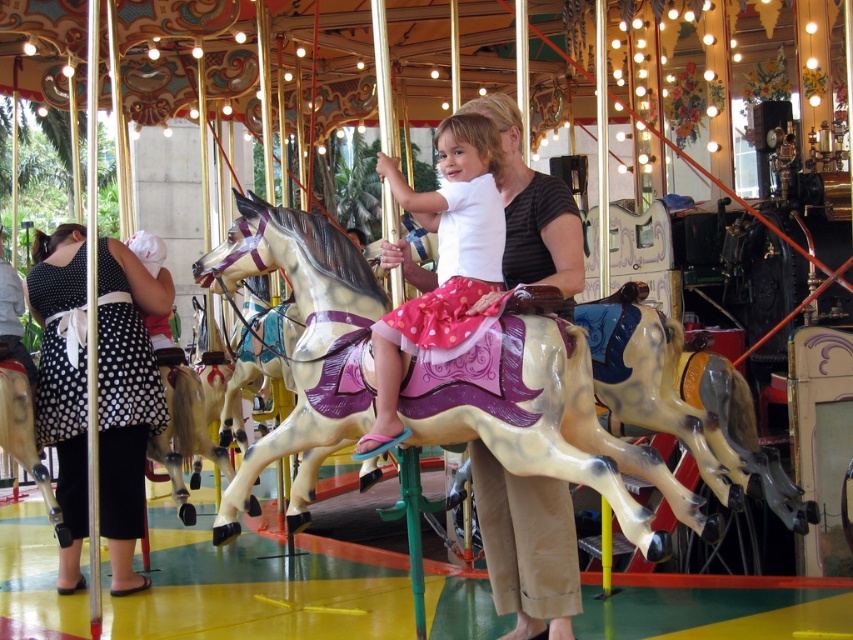
You are observing a carousel scene where a child and an adult are riding a horse carriage. You notice two shirts at the center of the image labeled as matte black shirt at center and matte white shirt at center. Which shirt is larger in size?

The matte black shirt at center is bigger than the matte white shirt at center.

You are standing in front of the carousel and want to determine which of the two points, point (251, 474) or point (74, 284), is nearer to you. Based on the scene description, which point is closer?

Point (251, 474) is closer to the viewer than point (74, 284).

You are a visitor at the carousel and want to know if you can safely reach the painted wood horse at center from the matte white shirt at center without stepping on the carousel floor. The maximum distance you can reach is 2 meters. Can you do it?

The distance between the painted wood horse at center and the matte white shirt at center is 2.29 meters, which is beyond your 2 meter reach. Therefore, you cannot safely reach the painted wood horse at center from the matte white shirt at center without stepping on the carousel floor.